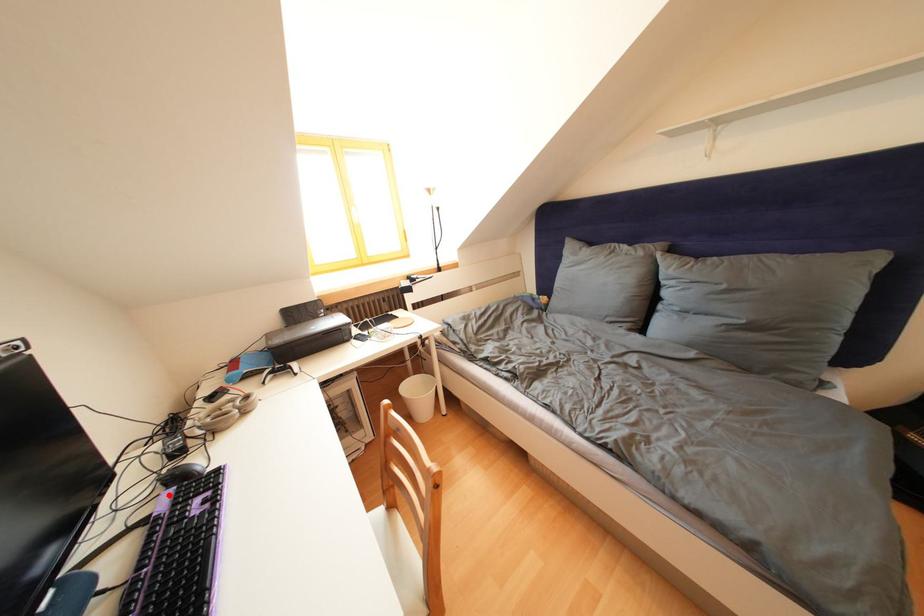
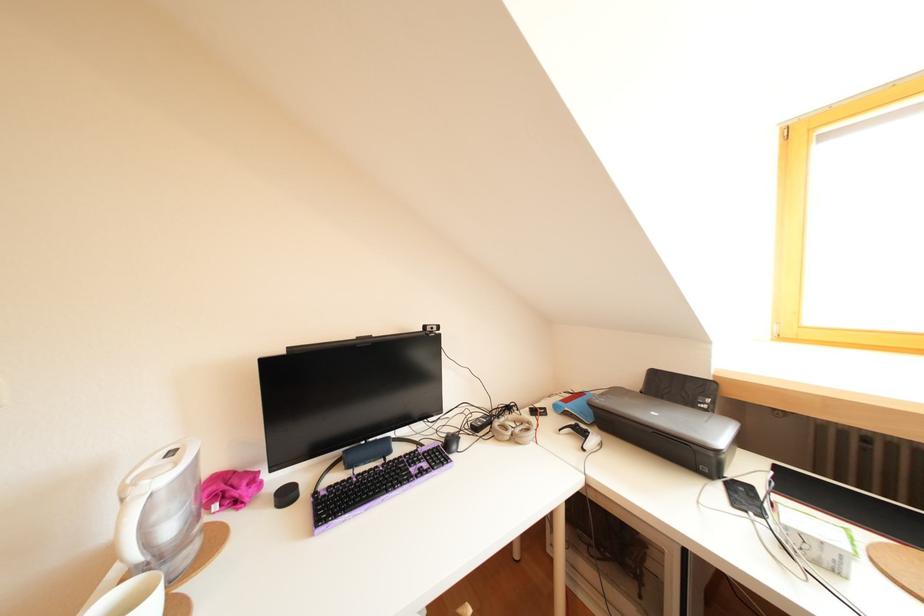
Where in the second image is the point corresponding to the highlighted location from the first image?

(453, 445)